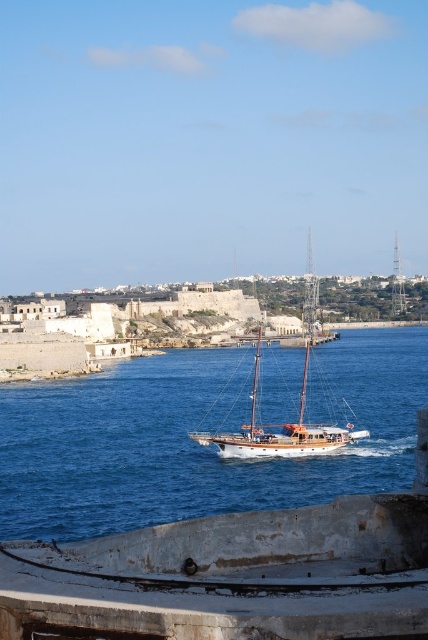
Who is higher up, blue water at center or wooden sailboat at center?

wooden sailboat at center is higher up.

Does blue water at center have a lesser width compared to wooden sailboat at center?

No.

Who is more forward, [237,502] or [303,385]?

Point [237,502] is more forward.

Where is `blue water at center`? The height and width of the screenshot is (640, 428). blue water at center is located at coordinates (195, 442).